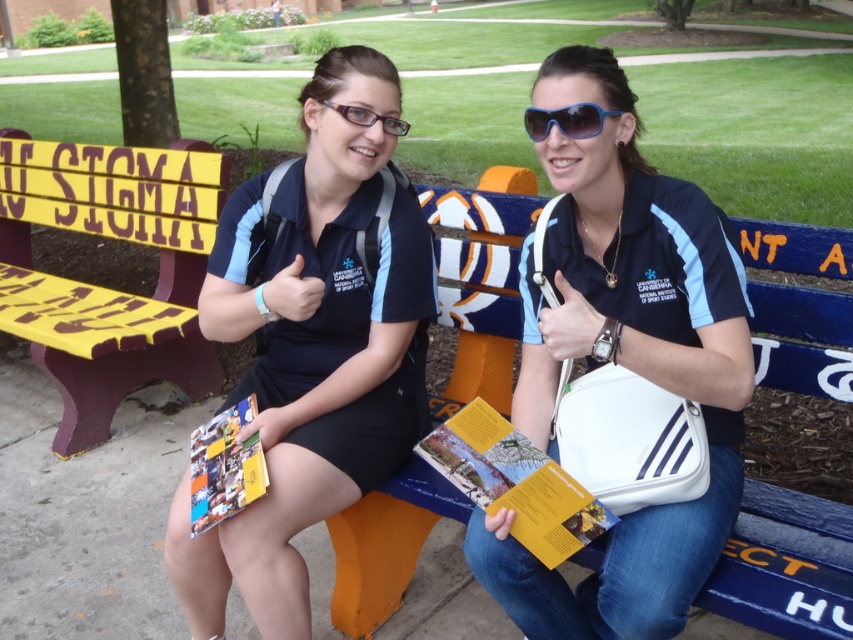
You are a photographer standing at the center of the scene. You want to take a photo of the navy blue shirt at center. Where should you position your camera to capture it?

The navy blue shirt at center is located at point (312, 348), so position your camera at the center of the scene to capture it accurately.

You are a photographer trying to capture a group photo of the two people wearing navy blue shirt at center. The camera you are using has a maximum focus range of 4 feet. Will you be able to fit both subjects into the frame without moving the camera?

The two people wearing navy blue shirt at center are 4.13 feet apart. Since the camera can only focus up to 4 feet, they are slightly too far apart to fit within the frame without moving the camera.